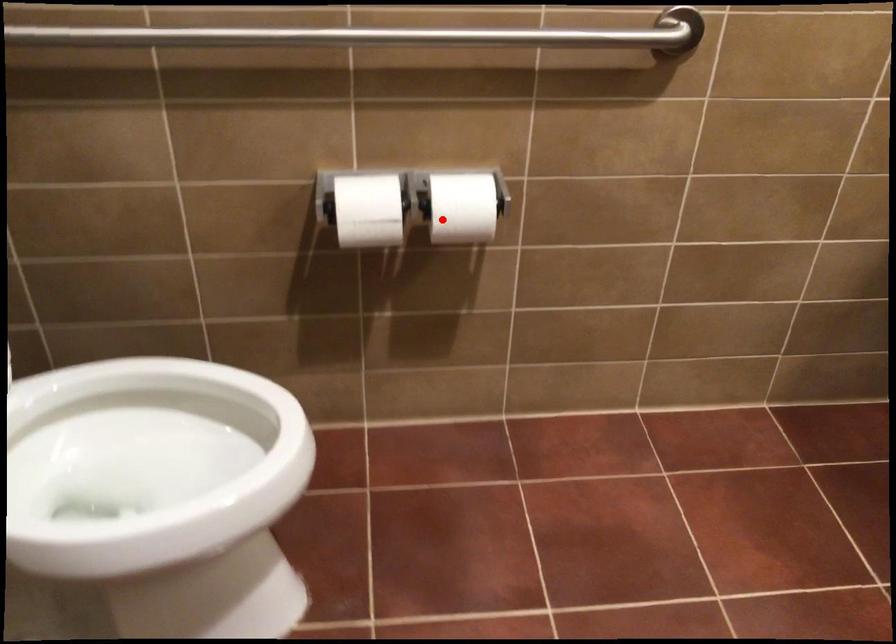
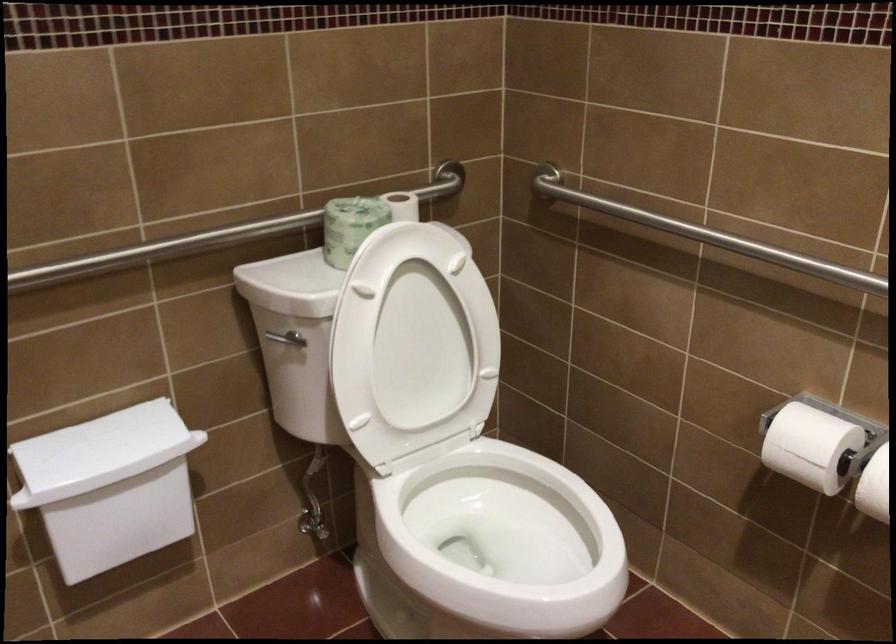
Locate, in the second image, the point that corresponds to the highlighted location in the first image.

(874, 486)